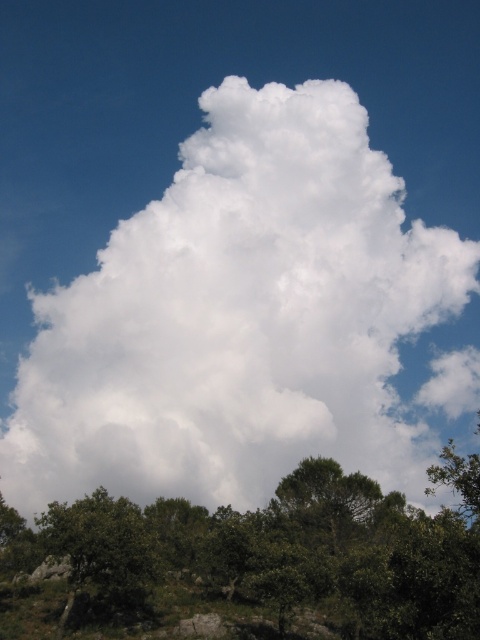
Who is lower down, green leafy tree at lower center or green leafy tree at lower left?

green leafy tree at lower center is lower down.

Does green leafy tree at lower center appear on the right side of green leafy tree at lower left?

Indeed, green leafy tree at lower center is positioned on the right side of green leafy tree at lower left.

Locate an element on the screen. This screenshot has width=480, height=640. green leafy tree at lower center is located at coordinates (268, 556).

Who is taller, white fluffy cloud at center or green leafy tree at lower left?

white fluffy cloud at center

This screenshot has height=640, width=480. Identify the location of white fluffy cloud at center. (240, 317).

Does point (132, 413) come farther from viewer compared to point (452, 509)?

That is True.

Find the location of a particular element. This screenshot has height=640, width=480. white fluffy cloud at center is located at coordinates (240, 317).